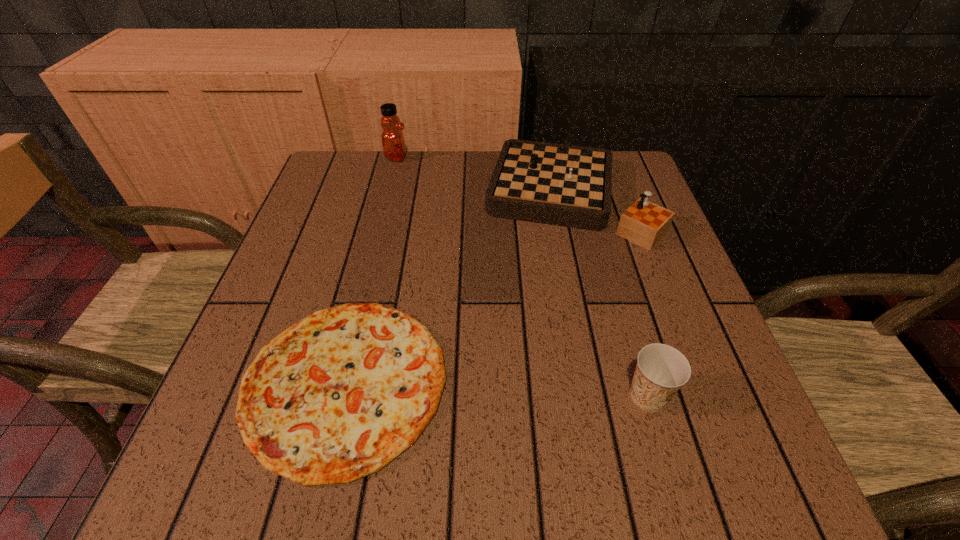
The image size is (960, 540). Find the location of `free space at the right edge`. free space at the right edge is located at coordinates (738, 390).

Locate an element on the screen. The height and width of the screenshot is (540, 960). vacant space at the far left corner of the desktop is located at coordinates (339, 150).

In the image, there is a desktop. At what (x,y) coordinates should I click in order to perform the action: click on vacant space at the far right corner. Please return your answer as a coordinate pair (x, y). This screenshot has width=960, height=540. Looking at the image, I should click on (633, 179).

At what (x,y) coordinates should I click in order to perform the action: click on vacant space in between the pizza and the honey. Please return your answer as a coordinate pair (x, y). This screenshot has height=540, width=960. Looking at the image, I should click on (371, 270).

Image resolution: width=960 pixels, height=540 pixels. I want to click on unoccupied area between the Dixie cup and the chessboard, so click(x=608, y=296).

Image resolution: width=960 pixels, height=540 pixels. Identify the location of empty location between the chessboard and the honey. (483, 177).

The height and width of the screenshot is (540, 960). I want to click on unoccupied area between the Dixie cup and the tallest object, so click(522, 276).

Find the location of `free point between the honey and the chessboard`. free point between the honey and the chessboard is located at coordinates (483, 177).

Find the location of a particular element. Image resolution: width=960 pixels, height=540 pixels. vacant space in between the tallest object and the shortest object is located at coordinates (371, 270).

At what (x,y) coordinates should I click in order to perform the action: click on vacant region between the tallest object and the pizza. Please return your answer as a coordinate pair (x, y). Looking at the image, I should click on (371, 270).